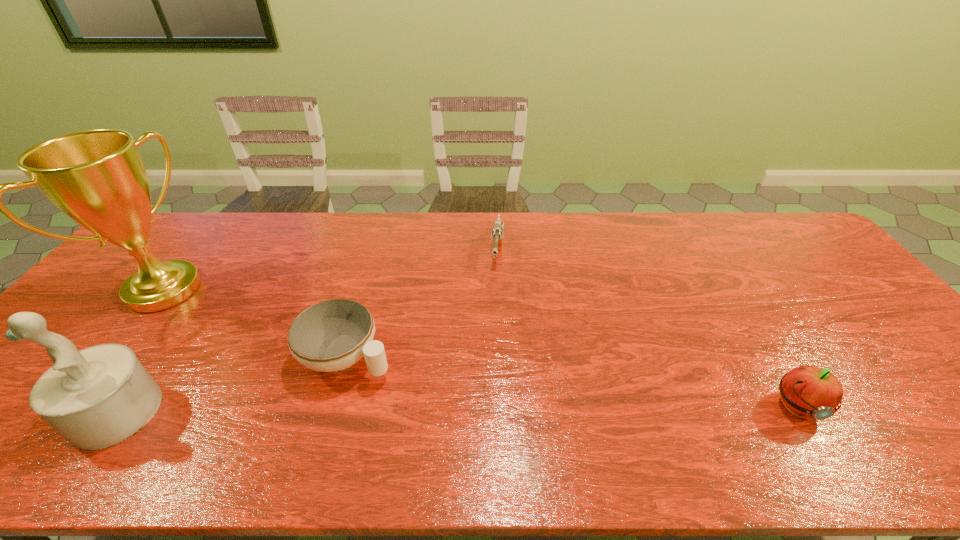
Identify the location of free space on the desktop that is between the fourth shortest object and the apple and is positioned aimed along the barrel of the gun. This screenshot has width=960, height=540. (479, 409).

Where is `free spot on the desktop that is between the figurine and the rightmost object and is positioned on the side with the handle of the chinaware`? The image size is (960, 540). free spot on the desktop that is between the figurine and the rightmost object and is positioned on the side with the handle of the chinaware is located at coordinates (446, 409).

The height and width of the screenshot is (540, 960). Find the location of `free space on the desktop that is between the second tallest object and the apple and is positioned by the handles of the tallest object`. free space on the desktop that is between the second tallest object and the apple and is positioned by the handles of the tallest object is located at coordinates (381, 410).